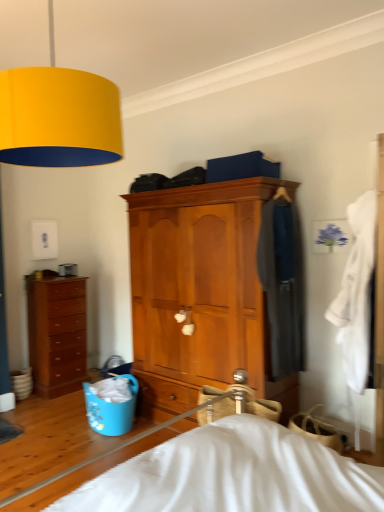
Where is `yellow matte lampshade at upper left`? The height and width of the screenshot is (512, 384). yellow matte lampshade at upper left is located at coordinates (58, 118).

The height and width of the screenshot is (512, 384). Describe the element at coordinates (111, 411) in the screenshot. I see `blue plastic laundry basket at lower left` at that location.

What do you see at coordinates (282, 284) in the screenshot? The image size is (384, 512). I see `dark gray fabric coat at center right, which ranks as the first clothing in back-to-front order` at bounding box center [282, 284].

Describe the element at coordinates (201, 293) in the screenshot. I see `wooden cabinet at center, positioned as the first chest of drawers in front-to-back order` at that location.

Describe the element at coordinates (57, 335) in the screenshot. I see `brown wooden chest of drawers at left, the 2th chest of drawers positioned from the right` at that location.

Where is `yellow matte lampshade at upper left`? The width and height of the screenshot is (384, 512). yellow matte lampshade at upper left is located at coordinates (58, 118).

Considering the sizes of objects white cotton robe at right, which ranks as the 1th clothing in front-to-back order, and brown wooden chest of drawers at left, the 2th chest of drawers positioned from the right, in the image provided, who is thinner, white cotton robe at right, which ranks as the 1th clothing in front-to-back order, or brown wooden chest of drawers at left, the 2th chest of drawers positioned from the right,?

Thinner between the two is white cotton robe at right, which ranks as the 1th clothing in front-to-back order.

Is white cotton robe at right, acting as the 2th clothing starting from the back, beside brown wooden chest of drawers at left, which appears as the 2th chest of drawers when viewed from the front?

No, white cotton robe at right, acting as the 2th clothing starting from the back, is not making contact with brown wooden chest of drawers at left, which appears as the 2th chest of drawers when viewed from the front.

Between white cotton robe at right, which ranks as the 1th clothing in front-to-back order, and brown wooden chest of drawers at left, which is counted as the 1th chest of drawers, starting from the left, which one has larger size?

Bigger between the two is brown wooden chest of drawers at left, which is counted as the 1th chest of drawers, starting from the left.

Is the position of yellow matte lampshade at upper left more distant than that of dark gray fabric coat at center right, which ranks as the first clothing in back-to-front order?

No, it is not.

Based on the photo, can you confirm if yellow matte lampshade at upper left is taller than dark gray fabric coat at center right, the second clothing in the front-to-back sequence?

No, yellow matte lampshade at upper left is not taller than dark gray fabric coat at center right, the second clothing in the front-to-back sequence.

Based on the photo, from the image's perspective, does yellow matte lampshade at upper left appear lower than dark gray fabric coat at center right, the second clothing in the front-to-back sequence?

Actually, yellow matte lampshade at upper left appears above dark gray fabric coat at center right, the second clothing in the front-to-back sequence, in the image.

Which point is more forward, (x=97, y=124) or (x=274, y=348)?

Point (x=97, y=124)

From the image's perspective, is yellow matte lampshade at upper left over brown wooden chest of drawers at left, which is counted as the 1th chest of drawers, starting from the left?

Yes, from the image's perspective, yellow matte lampshade at upper left is above brown wooden chest of drawers at left, which is counted as the 1th chest of drawers, starting from the left.

Considering the sizes of yellow matte lampshade at upper left and brown wooden chest of drawers at left, which appears as the first chest of drawers when viewed from the back, in the image, is yellow matte lampshade at upper left wider or thinner than brown wooden chest of drawers at left, which appears as the first chest of drawers when viewed from the back,?

In the image, yellow matte lampshade at upper left appears to be wider than brown wooden chest of drawers at left, which appears as the first chest of drawers when viewed from the back.

Looking at the image, does yellow matte lampshade at upper left seem bigger or smaller compared to brown wooden chest of drawers at left, which appears as the first chest of drawers when viewed from the back?

In the image, yellow matte lampshade at upper left appears to be larger than brown wooden chest of drawers at left, which appears as the first chest of drawers when viewed from the back.

Is point (362, 348) positioned before point (248, 288)?

That is True.

Can we say white cotton robe at right, which ranks as the 1th clothing in front-to-back order, lies outside wooden cabinet at center, the 1th chest of drawers from the right?

Yes, white cotton robe at right, which ranks as the 1th clothing in front-to-back order, is outside of wooden cabinet at center, the 1th chest of drawers from the right.

Is white cotton robe at right, acting as the 2th clothing starting from the back, in contact with wooden cabinet at center, the 1th chest of drawers from the right?

white cotton robe at right, acting as the 2th clothing starting from the back, is not next to wooden cabinet at center, the 1th chest of drawers from the right, and they're not touching.

Looking at their sizes, would you say white cotton robe at right, acting as the 2th clothing starting from the back, is wider or thinner than wooden cabinet at center, the 1th chest of drawers from the right?

Clearly, white cotton robe at right, acting as the 2th clothing starting from the back, has less width compared to wooden cabinet at center, the 1th chest of drawers from the right.

From a real-world perspective, is brown wooden chest of drawers at left, which is counted as the 1th chest of drawers, starting from the left, above or below dark gray fabric coat at center right, the second clothing in the front-to-back sequence?

Clearly, from a real-world perspective, brown wooden chest of drawers at left, which is counted as the 1th chest of drawers, starting from the left, is below dark gray fabric coat at center right, the second clothing in the front-to-back sequence.

Considering the positions of objects brown wooden chest of drawers at left, the 2th chest of drawers positioned from the right, and dark gray fabric coat at center right, which ranks as the first clothing in back-to-front order, in the image provided, who is in front, brown wooden chest of drawers at left, the 2th chest of drawers positioned from the right, or dark gray fabric coat at center right, which ranks as the first clothing in back-to-front order,?

dark gray fabric coat at center right, which ranks as the first clothing in back-to-front order, is closer to the camera.

From the picture: Can you tell me how much brown wooden chest of drawers at left, the 2th chest of drawers positioned from the right, and dark gray fabric coat at center right, which ranks as the first clothing in back-to-front order, differ in facing direction?

brown wooden chest of drawers at left, the 2th chest of drawers positioned from the right, and dark gray fabric coat at center right, which ranks as the first clothing in back-to-front order, are facing 3.45 degrees away from each other.

From the image's perspective, which one is positioned lower, brown wooden chest of drawers at left, the 2th chest of drawers positioned from the right, or dark gray fabric coat at center right, the second clothing in the front-to-back sequence?

brown wooden chest of drawers at left, the 2th chest of drawers positioned from the right, appears lower in the image.

Looking at this image, in the image, is white cotton robe at right, acting as the 2th clothing starting from the back, on the left side or the right side of blue plastic laundry basket at lower left?

Clearly, white cotton robe at right, acting as the 2th clothing starting from the back, is on the right of blue plastic laundry basket at lower left in the image.

Is white cotton robe at right, acting as the 2th clothing starting from the back, facing away from blue plastic laundry basket at lower left?

white cotton robe at right, acting as the 2th clothing starting from the back, is not turned away from blue plastic laundry basket at lower left.

From the image's perspective, does white cotton robe at right, which ranks as the 1th clothing in front-to-back order, appear lower than blue plastic laundry basket at lower left?

Incorrect, from the image's perspective, white cotton robe at right, which ranks as the 1th clothing in front-to-back order, is higher than blue plastic laundry basket at lower left.

Looking at this image, does brown wooden chest of drawers at left, which appears as the 2th chest of drawers when viewed from the front, have a lesser width compared to yellow matte lampshade at upper left?

Correct, the width of brown wooden chest of drawers at left, which appears as the 2th chest of drawers when viewed from the front, is less than that of yellow matte lampshade at upper left.

Where is `lamp in front of the brown wooden chest of drawers at left, the 2th chest of drawers positioned from the right`? This screenshot has height=512, width=384. lamp in front of the brown wooden chest of drawers at left, the 2th chest of drawers positioned from the right is located at coordinates click(58, 118).

Is brown wooden chest of drawers at left, the 2th chest of drawers positioned from the right, in front of or behind yellow matte lampshade at upper left in the image?

brown wooden chest of drawers at left, the 2th chest of drawers positioned from the right, is behind yellow matte lampshade at upper left.

The width and height of the screenshot is (384, 512). I want to click on the 2nd clothing in front of the brown wooden chest of drawers at left, which appears as the 2th chest of drawers when viewed from the front, starting your count from the anchor, so click(x=356, y=293).

From the yellow matte lampshade at upper left, count 1st clothing to the right and point to it. Please provide its 2D coordinates.

[(282, 284)]

Based on their spatial positions, is brown wooden chest of drawers at left, which is counted as the 1th chest of drawers, starting from the left, or white cotton robe at right, which ranks as the 1th clothing in front-to-back order, closer to yellow matte lampshade at upper left?

white cotton robe at right, which ranks as the 1th clothing in front-to-back order, lies closer to yellow matte lampshade at upper left than the other object.

In the scene shown: Looking at the image, which one is located further to white cotton robe at right, which ranks as the 1th clothing in front-to-back order, blue plastic laundry basket at lower left or dark gray fabric coat at center right, the second clothing in the front-to-back sequence?

Based on the image, blue plastic laundry basket at lower left appears to be further to white cotton robe at right, which ranks as the 1th clothing in front-to-back order.

In the scene shown: Based on their spatial positions, is wooden cabinet at center, the 2th chest of drawers from the back, or yellow matte lampshade at upper left further from brown wooden chest of drawers at left, which appears as the first chest of drawers when viewed from the back?

yellow matte lampshade at upper left.

Estimate the real-world distances between objects in this image. Which object is further from brown wooden chest of drawers at left, which appears as the 2th chest of drawers when viewed from the front, white cotton robe at right, acting as the 2th clothing starting from the back, or yellow matte lampshade at upper left?

white cotton robe at right, acting as the 2th clothing starting from the back.

Which object lies nearer to the anchor point dark gray fabric coat at center right, which ranks as the first clothing in back-to-front order, yellow matte lampshade at upper left or brown wooden chest of drawers at left, which appears as the first chest of drawers when viewed from the back?

yellow matte lampshade at upper left lies closer to dark gray fabric coat at center right, which ranks as the first clothing in back-to-front order, than the other object.

Estimate the real-world distances between objects in this image. Which object is closer to brown wooden chest of drawers at left, which appears as the 2th chest of drawers when viewed from the front, yellow matte lampshade at upper left or dark gray fabric coat at center right, the second clothing in the front-to-back sequence?

dark gray fabric coat at center right, the second clothing in the front-to-back sequence, lies closer to brown wooden chest of drawers at left, which appears as the 2th chest of drawers when viewed from the front, than the other object.

Looking at this image, from the image, which object appears to be farther from white cotton robe at right, acting as the 2th clothing starting from the back, wooden cabinet at center, positioned as the first chest of drawers in front-to-back order, or dark gray fabric coat at center right, which ranks as the first clothing in back-to-front order?

The object further to white cotton robe at right, acting as the 2th clothing starting from the back, is wooden cabinet at center, positioned as the first chest of drawers in front-to-back order.

Looking at the image, which one is located closer to dark gray fabric coat at center right, the second clothing in the front-to-back sequence, brown wooden chest of drawers at left, the 2th chest of drawers positioned from the right, or blue plastic laundry basket at lower left?

blue plastic laundry basket at lower left lies closer to dark gray fabric coat at center right, the second clothing in the front-to-back sequence, than the other object.

In order to click on clothing between blue plastic laundry basket at lower left and white cotton robe at right, acting as the 2th clothing starting from the back in this screenshot , I will do `click(282, 284)`.

This screenshot has width=384, height=512. I want to click on the chest of drawers located between yellow matte lampshade at upper left and brown wooden chest of drawers at left, which appears as the 2th chest of drawers when viewed from the front, in the depth direction, so click(201, 293).

You are a GUI agent. You are given a task and a screenshot of the screen. Output one action in this format:
    pyautogui.click(x=<x>, y=<y>)
    Task: Click on the laundry basket between brown wooden chest of drawers at left, which is counted as the 1th chest of drawers, starting from the left, and dark gray fabric coat at center right, the second clothing in the front-to-back sequence, from left to right
    
    Given the screenshot: What is the action you would take?
    pyautogui.click(x=111, y=411)

Where is `clothing located between yellow matte lampshade at upper left and dark gray fabric coat at center right, which ranks as the first clothing in back-to-front order, in the depth direction`? This screenshot has height=512, width=384. clothing located between yellow matte lampshade at upper left and dark gray fabric coat at center right, which ranks as the first clothing in back-to-front order, in the depth direction is located at coordinates (356, 293).